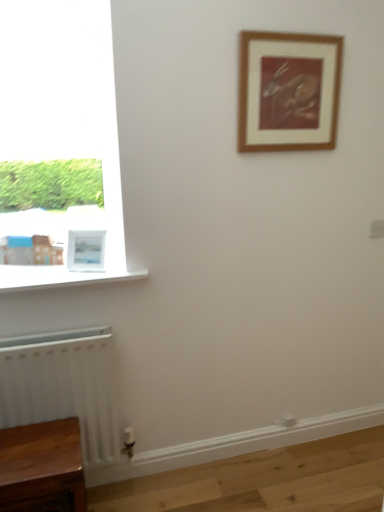
The height and width of the screenshot is (512, 384). What are the coordinates of `empty space that is ontop of wooden table at lower left (from a real-world perspective)` in the screenshot? It's located at (38, 443).